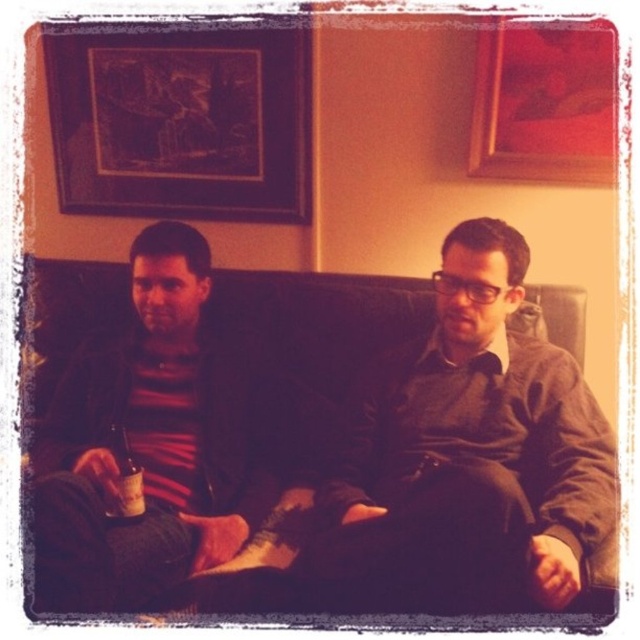
Does black leather couch at center have a lesser width compared to matte red picture frame at upper right?

No, black leather couch at center is not thinner than matte red picture frame at upper right.

Can you confirm if black leather couch at center is taller than matte red picture frame at upper right?

Indeed, black leather couch at center has a greater height compared to matte red picture frame at upper right.

Locate an element on the screen. This screenshot has height=640, width=640. black leather couch at center is located at coordinates (312, 445).

The width and height of the screenshot is (640, 640). Identify the location of black leather couch at center. (312, 445).

What do you see at coordinates (141, 444) in the screenshot?
I see `striped sweater at left` at bounding box center [141, 444].

Can you confirm if striped sweater at left is taller than wooden framed artwork at upper left?

Yes, striped sweater at left is taller than wooden framed artwork at upper left.

What do you see at coordinates (141, 444) in the screenshot? This screenshot has width=640, height=640. I see `striped sweater at left` at bounding box center [141, 444].

Where is `striped sweater at left`? The height and width of the screenshot is (640, 640). striped sweater at left is located at coordinates [141, 444].

Which is more to the left, wooden framed artwork at upper left or amber glass bottle at lower left?

Positioned to the left is wooden framed artwork at upper left.

Can you confirm if wooden framed artwork at upper left is positioned to the left of amber glass bottle at lower left?

Correct, you'll find wooden framed artwork at upper left to the left of amber glass bottle at lower left.

In order to click on wooden framed artwork at upper left in this screenshot , I will do `click(180, 122)`.

Locate an element on the screen. The height and width of the screenshot is (640, 640). wooden framed artwork at upper left is located at coordinates (180, 122).